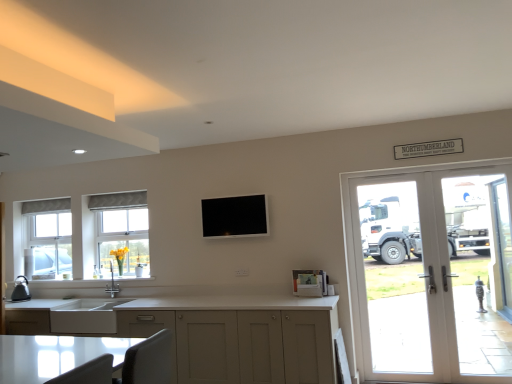
Question: Does white matte sink at lower left come behind white glass screen door at right, the 1th screen door in the front-to-back sequence?

Choices:
 (A) yes
 (B) no

Answer: (A)

Question: Is white matte sink at lower left looking in the opposite direction of white glass screen door at right, which is the second screen door in right-to-left order?

Choices:
 (A) yes
 (B) no

Answer: (B)

Question: Is white matte sink at lower left aimed at white glass screen door at right, the 1th screen door in the front-to-back sequence?

Choices:
 (A) yes
 (B) no

Answer: (B)

Question: Is white matte sink at lower left closer to camera compared to white glass screen door at right, the 1th screen door in the front-to-back sequence?

Choices:
 (A) no
 (B) yes

Answer: (A)

Question: From a real-world perspective, is white matte sink at lower left over white glass screen door at right, the 1th screen door in the front-to-back sequence?

Choices:
 (A) no
 (B) yes

Answer: (A)

Question: Visually, is matte black kettle at left positioned to the left or to the right of matte white cabinets at lower center?

Choices:
 (A) left
 (B) right

Answer: (A)

Question: Is matte black kettle at left spatially inside matte white cabinets at lower center, or outside of it?

Choices:
 (A) outside
 (B) inside

Answer: (B)

Question: From the image's perspective, is matte black kettle at left above or below matte white cabinets at lower center?

Choices:
 (A) below
 (B) above

Answer: (B)

Question: Is matte black kettle at left bigger or smaller than matte white cabinets at lower center?

Choices:
 (A) big
 (B) small

Answer: (B)

Question: From a real-world perspective, relative to matte black kettle at left, is clear glass door at right, acting as the second screen door starting from the left, vertically above or below?

Choices:
 (A) above
 (B) below

Answer: (B)

Question: Do you think clear glass door at right, arranged as the first screen door when viewed from the back, is within matte black kettle at left, or outside of it?

Choices:
 (A) inside
 (B) outside

Answer: (B)

Question: Looking at the image, does clear glass door at right, arranged as the first screen door when viewed from the back, seem bigger or smaller compared to matte black kettle at left?

Choices:
 (A) big
 (B) small

Answer: (A)

Question: In the image, is clear glass door at right, which is the first screen door in right-to-left order, positioned in front of or behind matte black kettle at left?

Choices:
 (A) front
 (B) behind

Answer: (B)

Question: Is clear glass door at right, the second screen door from the front, taller or shorter than white matte sink at lower left?

Choices:
 (A) tall
 (B) short

Answer: (A)

Question: From the image's perspective, is clear glass door at right, arranged as the first screen door when viewed from the back, located above or below white matte sink at lower left?

Choices:
 (A) below
 (B) above

Answer: (B)